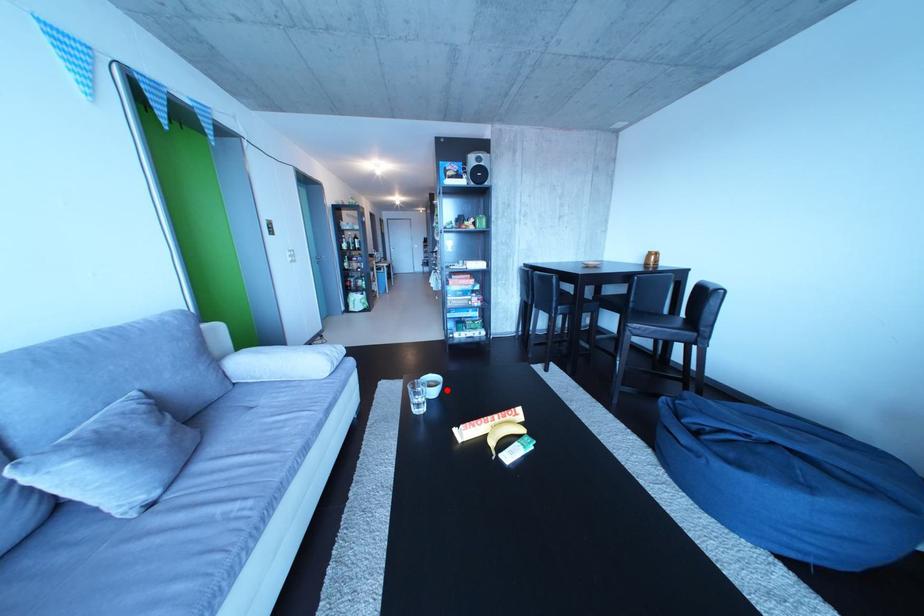
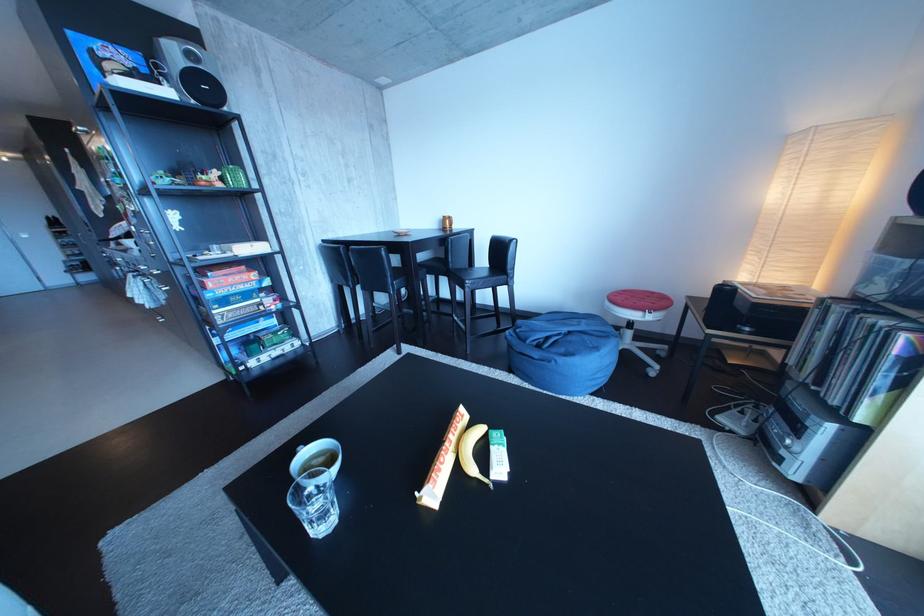
Question: I am providing you with two images of the same scene from different viewpoints. In image1, a red point is highlighted. Considering the same 3D point in image2, which of the following is correct?

Choices:
 (A) It is closer
 (B) It is farther

Answer: (B)